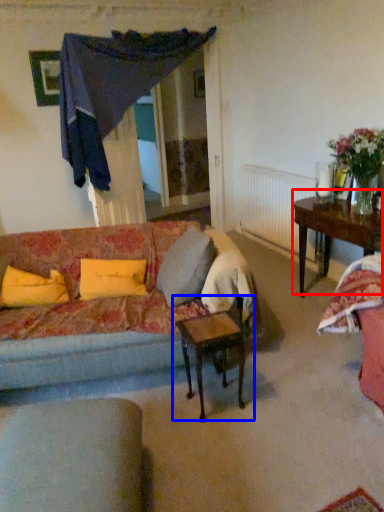
Question: Which of the following is the closest to the observer, table (highlighted by a red box) or table (highlighted by a blue box)?

Choices:
 (A) table
 (B) table

Answer: (B)